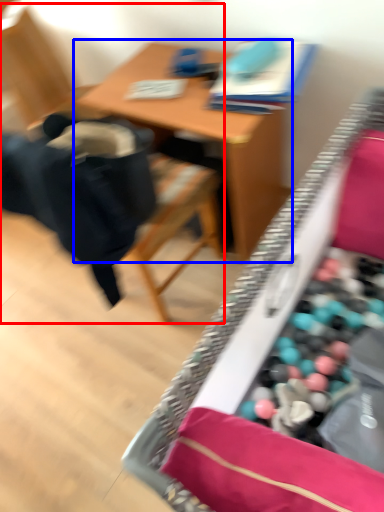
Question: Which object is further to the camera taking this photo, chair (highlighted by a red box) or table (highlighted by a blue box)?

Choices:
 (A) chair
 (B) table

Answer: (B)